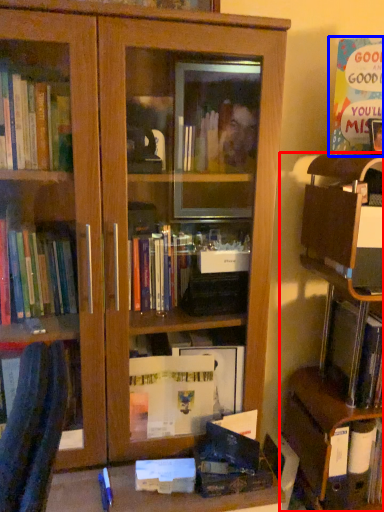
Question: Among these objects, which one is farthest to the camera, shelf (highlighted by a red box) or paperback book (highlighted by a blue box)?

Choices:
 (A) shelf
 (B) paperback book

Answer: (B)